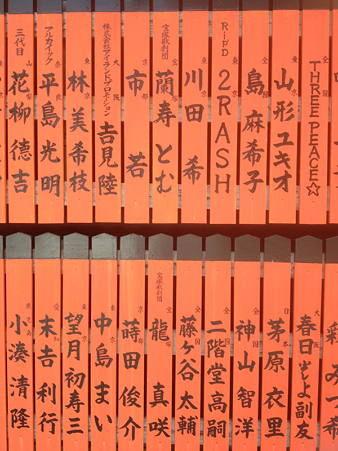
Show me where post its are located in the image. Your answer should be formatted as a list of tuples, i.e. [(x1, y1), (x2, y2), ...], where each tuple contains the x and y coordinates of a point satisfying the conditions above.

[(270, 303)]